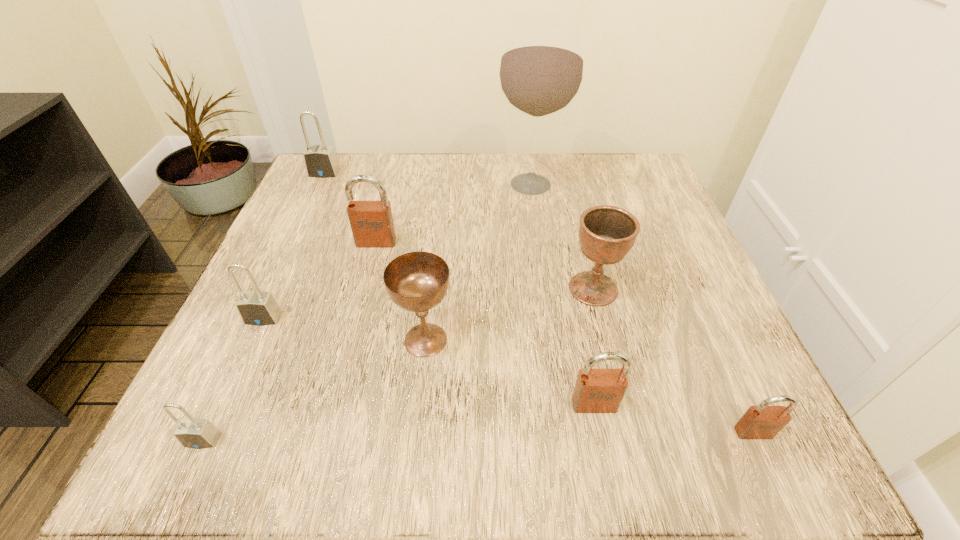
Image resolution: width=960 pixels, height=540 pixels. In order to click on empty space between the nearest gray padlock and the alcohol in this screenshot , I will do `click(367, 312)`.

Locate an element on the screen. vacant area between the nearest gray padlock and the nearer chalice is located at coordinates (314, 390).

This screenshot has height=540, width=960. Find the location of `vacant region between the second smallest gray padlock and the biggest gray padlock`. vacant region between the second smallest gray padlock and the biggest gray padlock is located at coordinates coord(294,246).

Locate an element on the screen. The width and height of the screenshot is (960, 540). free spot between the second farthest padlock and the nearest brown padlock is located at coordinates (564, 338).

Find the location of a particular element. empty space that is in between the second padlock from right to left and the nearest gray padlock is located at coordinates (398, 422).

Locate an element on the screen. empty location between the nearest gray padlock and the nearest brown padlock is located at coordinates (478, 436).

Where is `the closest object to the second nearest brown padlock`? the closest object to the second nearest brown padlock is located at coordinates (763, 421).

I want to click on the closest object to the rightmost object, so click(596, 390).

You are a GUI agent. You are given a task and a screenshot of the screen. Output one action in this format:
    pyautogui.click(x=<x>, y=<y>)
    Task: Click on the padlock that is the third closest to the left chalice
    
    Given the screenshot: What is the action you would take?
    pyautogui.click(x=259, y=308)

Identify which padlock is the fifth closest to the second biggest brown padlock. Please provide its 2D coordinates. Your answer should be formatted as a tuple, i.e. [(x, y)], where the tuple contains the x and y coordinates of a point satisfying the conditions above.

[(320, 161)]